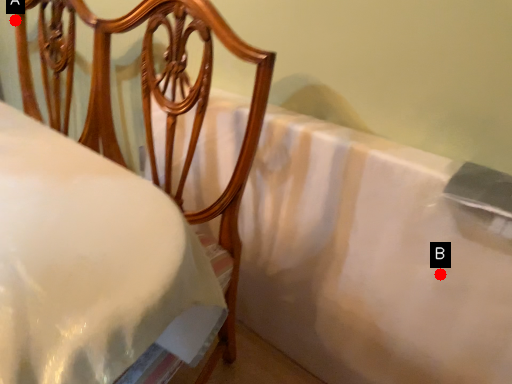
Question: Two points are circled on the image, labeled by A and B beside each circle. Which of the following is the closest to the observer?

Choices:
 (A) A is closer
 (B) B is closer

Answer: (B)